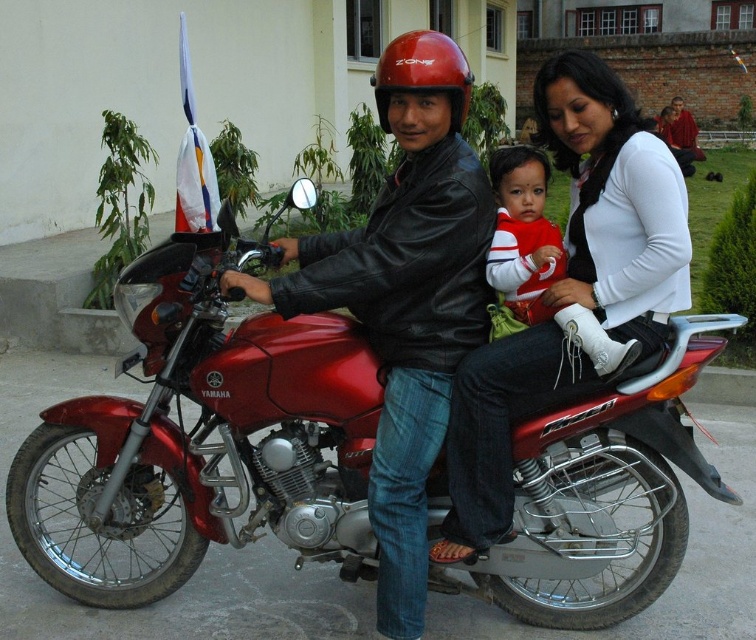
Question: Among these objects, which one is nearest to the camera?

Choices:
 (A) matte black leather jacket at center
 (B) metallic red motorcycle at center
 (C) red and white striped shirt at center

Answer: (A)

Question: Estimate the real-world distances between objects in this image. Which object is closer to the white leather boot at center?

Choices:
 (A) matte white sweater at center
 (B) matte black leather jacket at center

Answer: (A)

Question: Does red and white striped shirt at center appear on the right side of red matte helmet at center?

Choices:
 (A) yes
 (B) no

Answer: (A)

Question: Can you confirm if metallic red motorcycle at center is smaller than white leather boot at center?

Choices:
 (A) yes
 (B) no

Answer: (B)

Question: Among these objects, which one is nearest to the camera?

Choices:
 (A) metallic red motorcycle at center
 (B) matte white sweater at center

Answer: (B)

Question: Does matte black leather jacket at center have a greater width compared to red matte helmet at center?

Choices:
 (A) no
 (B) yes

Answer: (B)